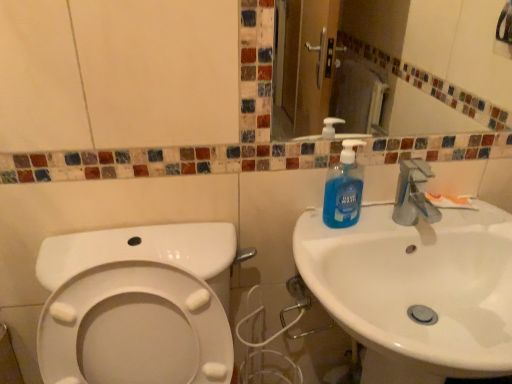
Question: From the image's perspective, is blue liquid soap at sink right positioned above or below white matte toothpaste at sink right?

Choices:
 (A) below
 (B) above

Answer: (B)

Question: Considering the positions of blue liquid soap at sink right and white matte toothpaste at sink right in the image, is blue liquid soap at sink right taller or shorter than white matte toothpaste at sink right?

Choices:
 (A) short
 (B) tall

Answer: (B)

Question: Estimate the real-world distances between objects in this image. Which object is closer to the white matte toothpaste at sink right?

Choices:
 (A) blue liquid soap at sink right
 (B) white glossy sink at right

Answer: (A)

Question: Estimate the real-world distances between objects in this image. Which object is closer to the blue liquid soap at sink right?

Choices:
 (A) white glossy sink at right
 (B) white matte toothpaste at sink right

Answer: (A)